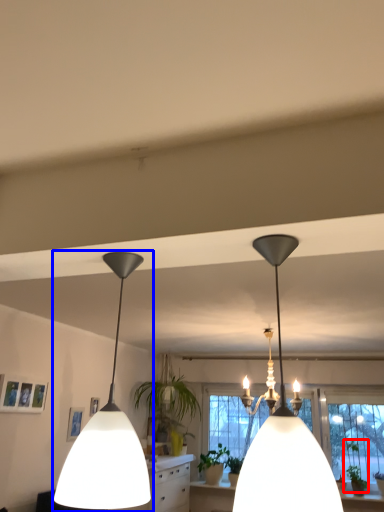
Question: Which object is closer to the camera taking this photo, plant (highlighted by a red box) or lamp (highlighted by a blue box)?

Choices:
 (A) plant
 (B) lamp

Answer: (B)